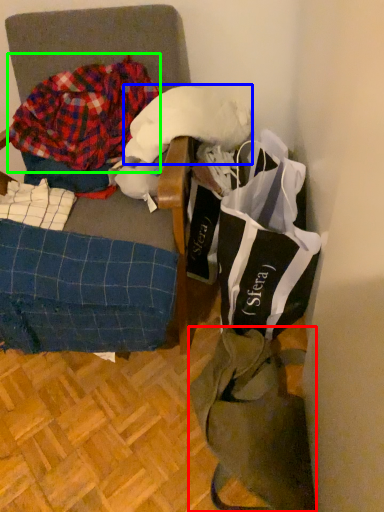
Question: Which object is the closest to the tote bag (highlighted by a red box)? Choose among these: wool (highlighted by a blue box) or flannel (highlighted by a green box).

Choices:
 (A) wool
 (B) flannel

Answer: (A)